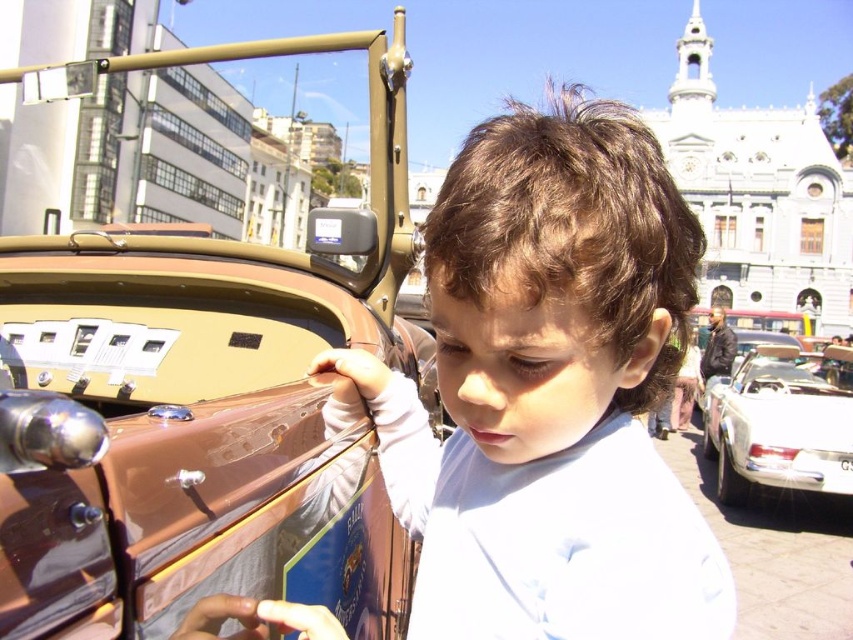
Question: Which object appears farthest from the camera in this image?

Choices:
 (A) shiny brown car door at center
 (B) matte brown hair at center
 (C) white glossy car at right

Answer: (C)

Question: Which is farther from the white glossy car at right?

Choices:
 (A) shiny brown car door at center
 (B) matte brown hair at center

Answer: (A)

Question: Does shiny brown car door at center come behind white glossy car at right?

Choices:
 (A) no
 (B) yes

Answer: (A)

Question: Does matte brown hair at center have a greater width compared to white glossy car at right?

Choices:
 (A) yes
 (B) no

Answer: (A)

Question: Can you confirm if matte brown hair at center is positioned to the right of white glossy car at right?

Choices:
 (A) no
 (B) yes

Answer: (A)

Question: Which point appears farthest from the camera in this image?

Choices:
 (A) (357, 381)
 (B) (225, 456)
 (C) (827, 372)

Answer: (C)